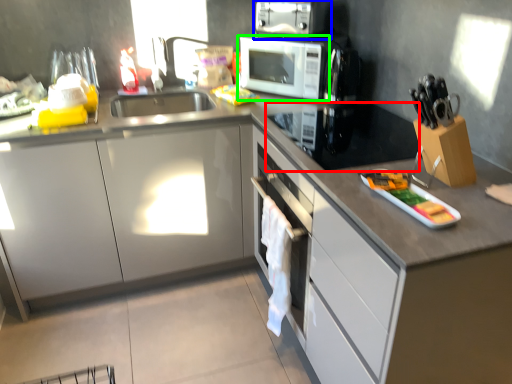
Question: Which is nearer to the appliance (highlighted by a red box)? kitchen appliance (highlighted by a blue box) or home appliance (highlighted by a green box).

Choices:
 (A) kitchen appliance
 (B) home appliance

Answer: (B)